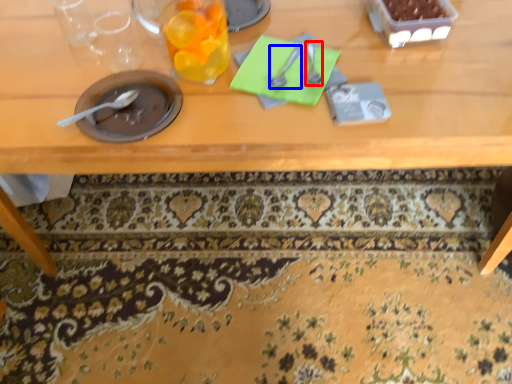
Question: Which object is closer to the camera taking this photo, tableware (highlighted by a red box) or tableware (highlighted by a blue box)?

Choices:
 (A) tableware
 (B) tableware

Answer: (B)